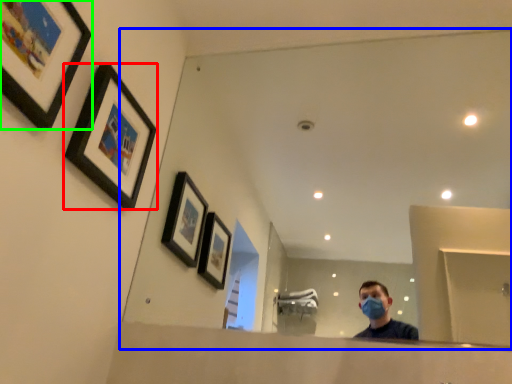
Question: Estimate the real-world distances between objects in this image. Which object is closer to picture frame (highlighted by a red box), mirror (highlighted by a blue box) or picture frame (highlighted by a green box)?

Choices:
 (A) mirror
 (B) picture frame

Answer: (B)